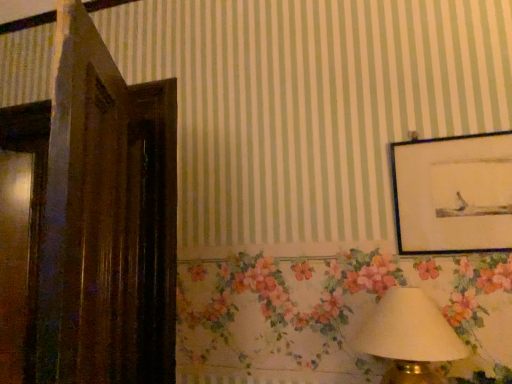
Describe the element at coordinates (453, 194) in the screenshot. This screenshot has width=512, height=384. I see `matte black picture frame at upper right` at that location.

Find the location of a particular element. matte black picture frame at upper right is located at coordinates (453, 194).

The image size is (512, 384). Find the location of `white fabric lampshade at lower right`. white fabric lampshade at lower right is located at coordinates (409, 336).

This screenshot has height=384, width=512. What do you see at coordinates (409, 336) in the screenshot?
I see `white fabric lampshade at lower right` at bounding box center [409, 336].

What is the approximate width of white fabric lampshade at lower right?

white fabric lampshade at lower right is 33.44 centimeters in width.

Identify the location of matte black picture frame at upper right. The image size is (512, 384). (453, 194).

Based on their positions, is white fabric lampshade at lower right located to the left or right of matte black picture frame at upper right?

From the image, it's evident that white fabric lampshade at lower right is to the left of matte black picture frame at upper right.

Between white fabric lampshade at lower right and matte black picture frame at upper right, which one is positioned in front?

Positioned in front is white fabric lampshade at lower right.

Is point (411, 355) farther from viewer compared to point (429, 146)?

No, (411, 355) is in front of (429, 146).

From the image's perspective, relative to matte black picture frame at upper right, is white fabric lampshade at lower right above or below?

Clearly, from the image's perspective, white fabric lampshade at lower right is below matte black picture frame at upper right.

From the picture: From a real-world perspective, is white fabric lampshade at lower right located higher than matte black picture frame at upper right?

Incorrect, from a real-world perspective, white fabric lampshade at lower right is lower than matte black picture frame at upper right.

Based on the photo, looking at their sizes, would you say white fabric lampshade at lower right is wider or thinner than matte black picture frame at upper right?

Clearly, white fabric lampshade at lower right has more width compared to matte black picture frame at upper right.

Does white fabric lampshade at lower right have a lesser height compared to matte black picture frame at upper right?

Indeed, white fabric lampshade at lower right has a lesser height compared to matte black picture frame at upper right.

Who is bigger, white fabric lampshade at lower right or matte black picture frame at upper right?

Bigger between the two is white fabric lampshade at lower right.

Is matte black picture frame at upper right completely or partially inside white fabric lampshade at lower right?

No, matte black picture frame at upper right is located outside of white fabric lampshade at lower right.

Is white fabric lampshade at lower right in contact with matte black picture frame at upper right?

No, white fabric lampshade at lower right is not touching matte black picture frame at upper right.

Is white fabric lampshade at lower right aimed at matte black picture frame at upper right?

No, white fabric lampshade at lower right is not facing towards matte black picture frame at upper right.

How many degrees apart are the facing directions of white fabric lampshade at lower right and matte black picture frame at upper right?

1.18 degrees.

Measure the distance from white fabric lampshade at lower right to matte black picture frame at upper right.

white fabric lampshade at lower right is 15.76 inches away from matte black picture frame at upper right.

There is a white fabric lampshade at lower right. Identify the location of picture frame above it (from a real-world perspective). (453, 194).

Would you say matte black picture frame at upper right is to the left or to the right of white fabric lampshade at lower right in the picture?

Based on their positions, matte black picture frame at upper right is located to the right of white fabric lampshade at lower right.

Is matte black picture frame at upper right closer to the viewer compared to white fabric lampshade at lower right?

No, matte black picture frame at upper right is behind white fabric lampshade at lower right.

Which is closer to the camera, (400,220) or (461,356)?

Point (400,220).

From the image's perspective, is matte black picture frame at upper right beneath white fabric lampshade at lower right?

No, from the image's perspective, matte black picture frame at upper right is not below white fabric lampshade at lower right.

From a real-world perspective, which object rests below the other?

white fabric lampshade at lower right is physically lower.

Considering the relative sizes of matte black picture frame at upper right and white fabric lampshade at lower right in the image provided, is matte black picture frame at upper right thinner than white fabric lampshade at lower right?

Yes, matte black picture frame at upper right is thinner than white fabric lampshade at lower right.

Does matte black picture frame at upper right have a greater height compared to white fabric lampshade at lower right?

Yes, matte black picture frame at upper right is taller than white fabric lampshade at lower right.

In terms of size, does matte black picture frame at upper right appear bigger or smaller than white fabric lampshade at lower right?

In the image, matte black picture frame at upper right appears to be smaller than white fabric lampshade at lower right.

Which is correct: matte black picture frame at upper right is inside white fabric lampshade at lower right, or outside of it?

matte black picture frame at upper right is located beyond the bounds of white fabric lampshade at lower right.

Is matte black picture frame at upper right directly adjacent to white fabric lampshade at lower right?

No, matte black picture frame at upper right is not making contact with white fabric lampshade at lower right.

Could you tell me if matte black picture frame at upper right is turned towards white fabric lampshade at lower right?

No, matte black picture frame at upper right is not facing towards white fabric lampshade at lower right.

I want to click on table lamp below the matte black picture frame at upper right (from a real-world perspective), so click(x=409, y=336).

This screenshot has width=512, height=384. Find the location of `picture frame behind the white fabric lampshade at lower right`. picture frame behind the white fabric lampshade at lower right is located at coordinates (453, 194).

This screenshot has height=384, width=512. Find the location of `picture frame located above the white fabric lampshade at lower right (from the image's perspective)`. picture frame located above the white fabric lampshade at lower right (from the image's perspective) is located at coordinates (453, 194).